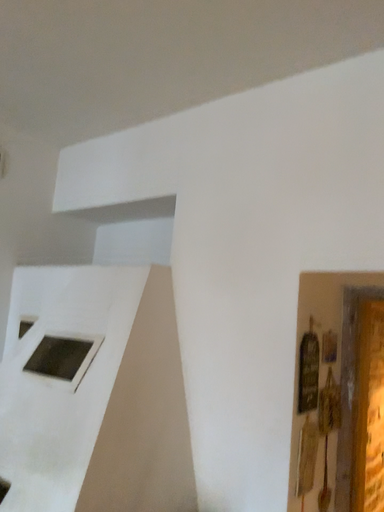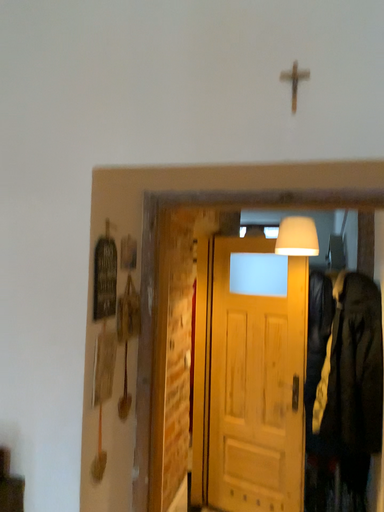
Question: Which way did the camera rotate in the video?

Choices:
 (A) rotated left
 (B) rotated right

Answer: (B)